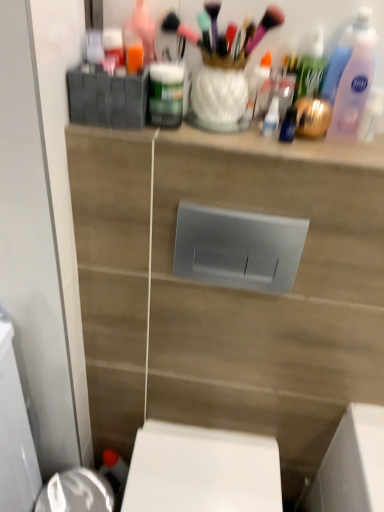
Question: Does matte plastic toiletries at upper center have a lesser height compared to pink plastic bottle at upper right?

Choices:
 (A) no
 (B) yes

Answer: (B)

Question: Does matte plastic toiletries at upper center have a larger size compared to pink plastic bottle at upper right?

Choices:
 (A) yes
 (B) no

Answer: (A)

Question: From a real-world perspective, does matte plastic toiletries at upper center stand above pink plastic bottle at upper right?

Choices:
 (A) yes
 (B) no

Answer: (B)

Question: Is matte plastic toiletries at upper center smaller than pink plastic bottle at upper right?

Choices:
 (A) no
 (B) yes

Answer: (A)

Question: Can you confirm if matte plastic toiletries at upper center is thinner than pink plastic bottle at upper right?

Choices:
 (A) no
 (B) yes

Answer: (A)

Question: Would you say pink plastic bottle at upper right is to the left or to the right of matte plastic toiletries at upper center in the picture?

Choices:
 (A) right
 (B) left

Answer: (A)

Question: In terms of width, does pink plastic bottle at upper right look wider or thinner when compared to matte plastic toiletries at upper center?

Choices:
 (A) thin
 (B) wide

Answer: (A)

Question: Based on their sizes in the image, would you say pink plastic bottle at upper right is bigger or smaller than matte plastic toiletries at upper center?

Choices:
 (A) big
 (B) small

Answer: (B)

Question: Would you say pink plastic bottle at upper right is inside or outside matte plastic toiletries at upper center?

Choices:
 (A) outside
 (B) inside

Answer: (A)

Question: From a real-world perspective, is matte plastic toiletries at upper center physically located above or below pink plastic bottle at upper right?

Choices:
 (A) below
 (B) above

Answer: (A)

Question: Considering the positions of point (261, 147) and point (369, 11), is point (261, 147) closer or farther from the camera than point (369, 11)?

Choices:
 (A) farther
 (B) closer

Answer: (B)

Question: From the image's perspective, is matte plastic toiletries at upper center above or below pink plastic bottle at upper right?

Choices:
 (A) below
 (B) above

Answer: (A)

Question: Considering the positions of matte plastic toiletries at upper center and pink plastic bottle at upper right in the image, is matte plastic toiletries at upper center bigger or smaller than pink plastic bottle at upper right?

Choices:
 (A) small
 (B) big

Answer: (B)

Question: Is matte green jar at upper center situated inside pink plastic bottle at upper right or outside?

Choices:
 (A) outside
 (B) inside

Answer: (A)

Question: In terms of height, does matte green jar at upper center look taller or shorter compared to pink plastic bottle at upper right?

Choices:
 (A) short
 (B) tall

Answer: (A)